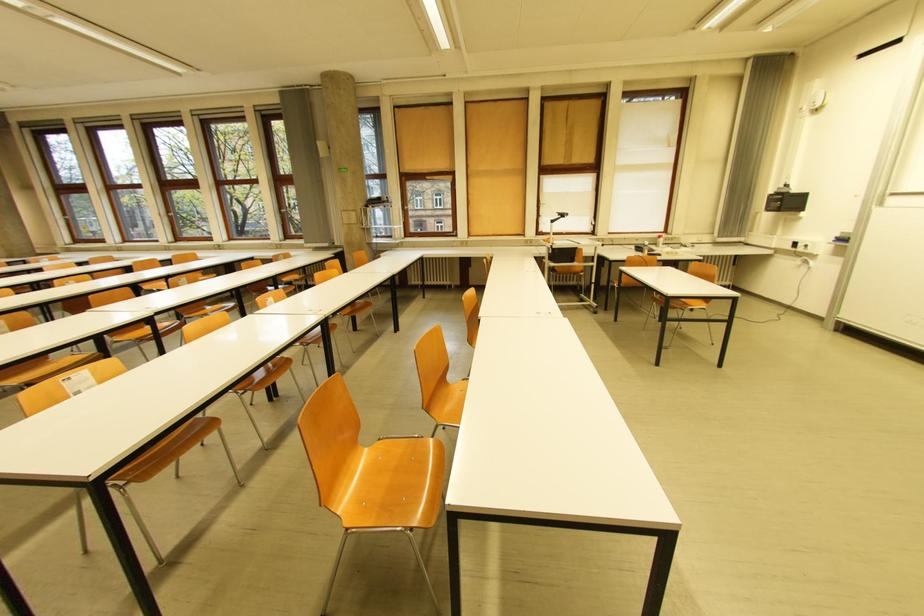
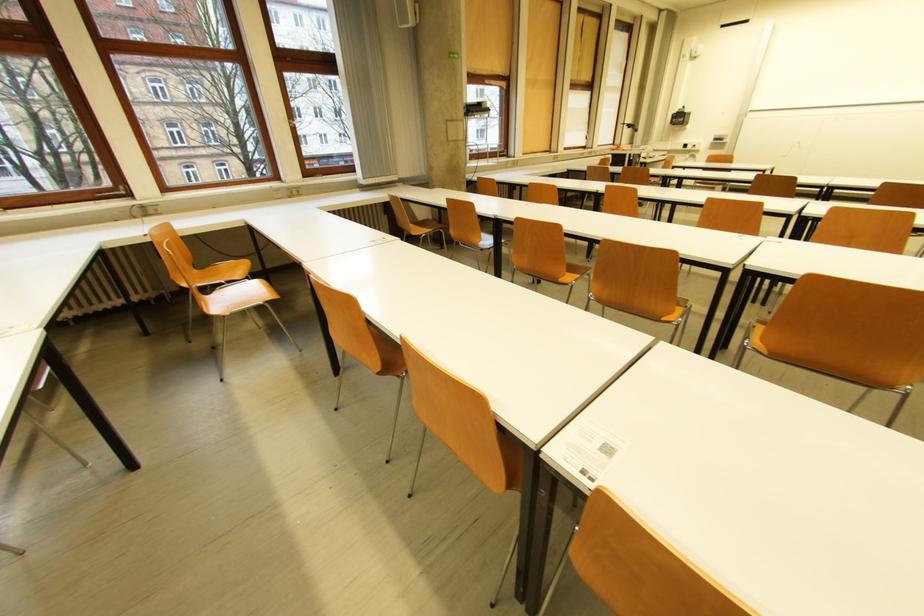
Find the pixel in the second image that matches (x=801, y=245) in the first image.

(691, 147)